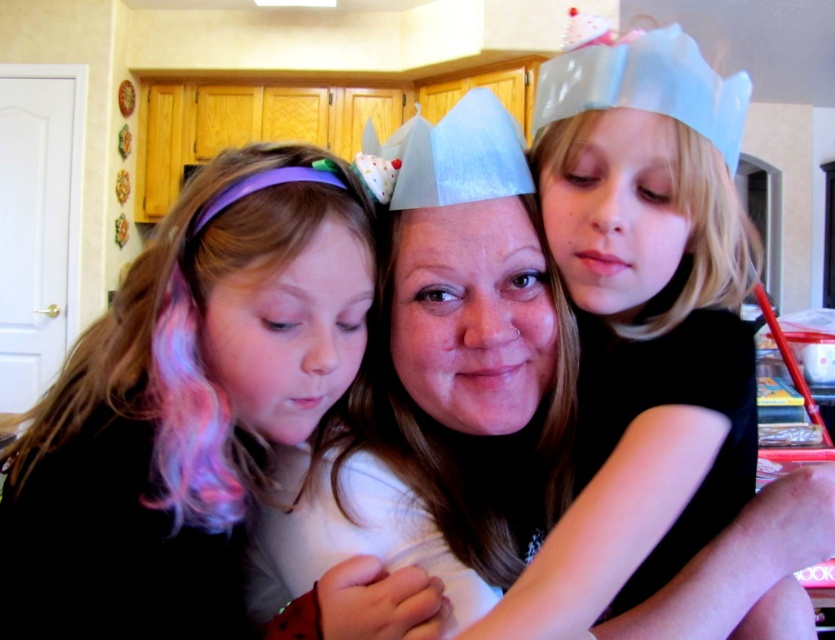
Is matte purple headband at left smaller than matte white crown at center?

Yes, matte purple headband at left is smaller than matte white crown at center.

Find the location of `matte purple headband at left`. matte purple headband at left is located at coordinates (200, 420).